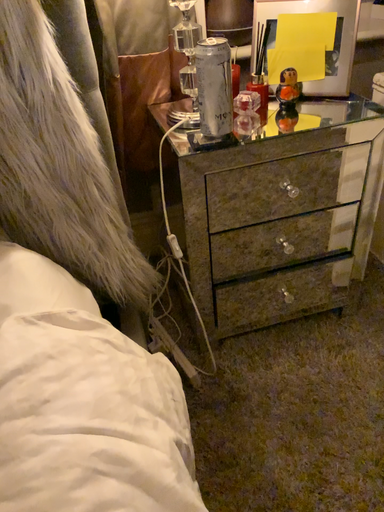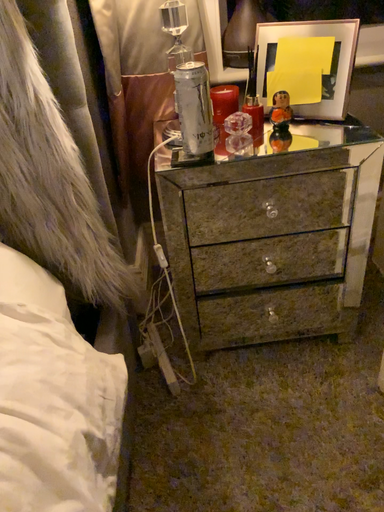
Question: How did the camera likely rotate when shooting the video?

Choices:
 (A) rotated right
 (B) rotated left

Answer: (B)